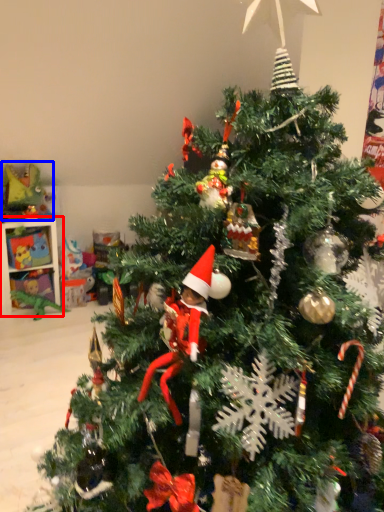
Question: Which of the following is the farthest to the observer, shelf (highlighted by a red box) or toy (highlighted by a blue box)?

Choices:
 (A) shelf
 (B) toy

Answer: (A)